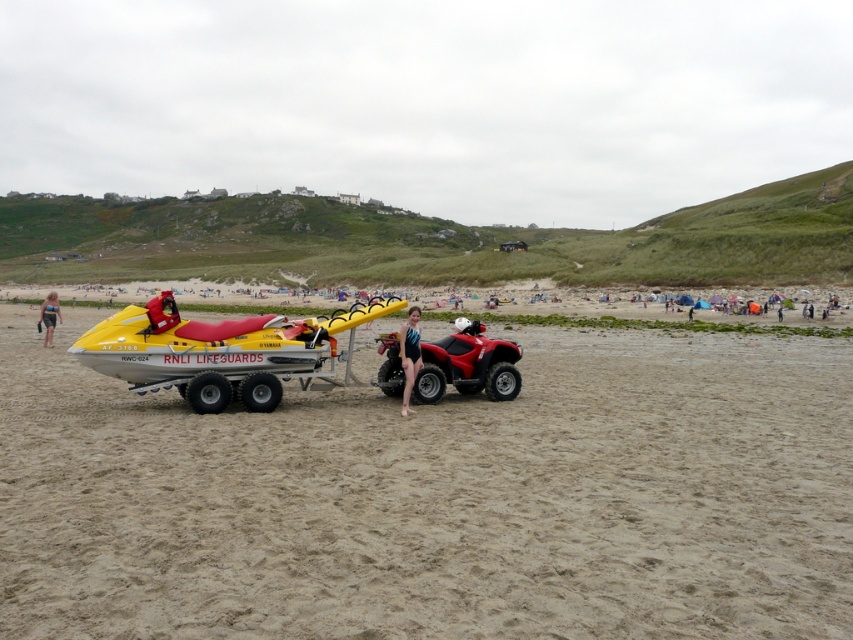
Who is positioned more to the right, matte red quad bike at center or matte black swimsuit at left?

A: matte red quad bike at center

Between point (465, 328) and point (50, 301), which one is positioned behind?

The point (50, 301) is behind.

Identify the location of matte red quad bike at center. (468, 365).

Identify the location of matte red quad bike at center. (468, 365).

Between matte red quad bike at center and blue swimsuit at center, which one appears on the right side from the viewer's perspective?

matte red quad bike at center

Consider the image. Does matte red quad bike at center have a greater width compared to blue swimsuit at center?

Correct, the width of matte red quad bike at center exceeds that of blue swimsuit at center.

Image resolution: width=853 pixels, height=640 pixels. What do you see at coordinates (468, 365) in the screenshot?
I see `matte red quad bike at center` at bounding box center [468, 365].

What are the coordinates of `matte red quad bike at center` in the screenshot? It's located at click(x=468, y=365).

Can you confirm if yellow matte lifeboat at center is positioned above blue swimsuit at center?

Indeed, yellow matte lifeboat at center is positioned over blue swimsuit at center.

Is point (202, 368) positioned before point (416, 348)?

Yes, it is in front of point (416, 348).

This screenshot has height=640, width=853. I want to click on yellow matte lifeboat at center, so click(218, 349).